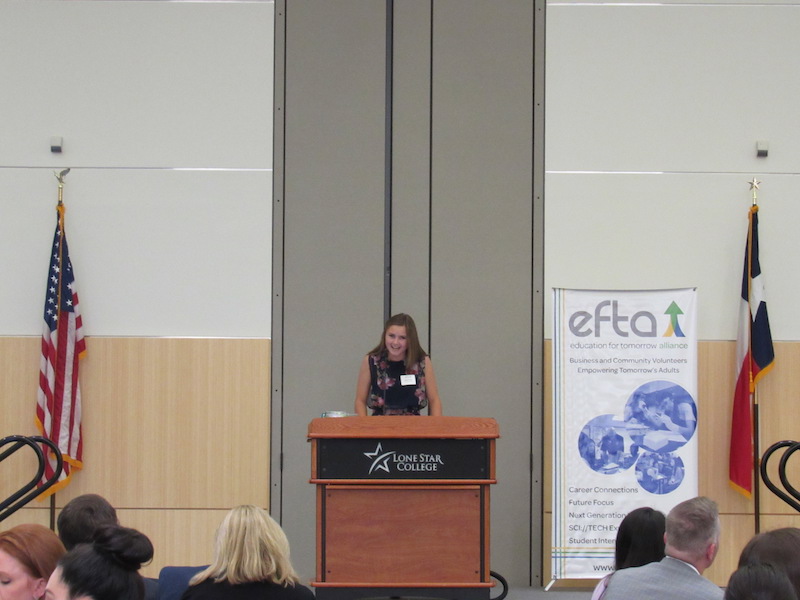
You are a GUI agent. You are given a task and a screenshot of the screen. Output one action in this format:
    pyautogui.click(x=<x>, y=<y>)
    Task: Click on the grey vertical wall section
    This screenshot has height=600, width=800.
    Given the screenshot: What is the action you would take?
    pyautogui.click(x=478, y=154)